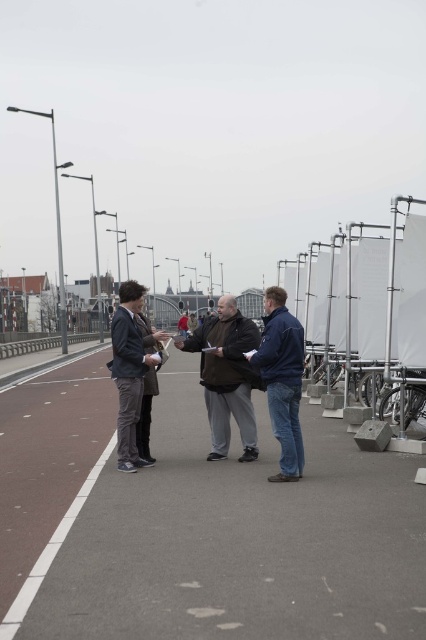
Question: Is dark gray jacket at center below matte black glove at center?

Choices:
 (A) yes
 (B) no

Answer: (A)

Question: Which point appears farthest from the camera in this image?

Choices:
 (A) pos(149,362)
 (B) pos(155,339)
 (C) pos(227,433)

Answer: (C)

Question: Which object is closer to the camera taking this photo?

Choices:
 (A) dark gray jacket at center
 (B) matte black hand at center

Answer: (A)

Question: Does dark blue jacket at center have a larger size compared to matte black hand at center?

Choices:
 (A) no
 (B) yes

Answer: (A)

Question: Estimate the real-world distances between objects in this image. Which object is farther from the dark blue jacket at center?

Choices:
 (A) matte black glove at center
 (B) matte black hand at center
 (C) dark gray jacket at center

Answer: (B)

Question: Does dark gray jacket at center have a smaller size compared to matte black hand at center?

Choices:
 (A) yes
 (B) no

Answer: (A)